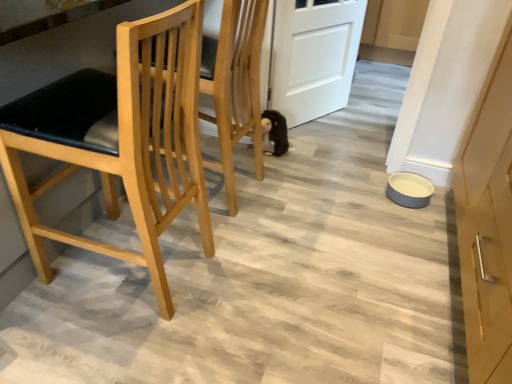
Question: Is natural wood chair at left situated inside black plush toy at center or outside?

Choices:
 (A) outside
 (B) inside

Answer: (A)

Question: In the image, is natural wood chair at left positioned in front of or behind black plush toy at center?

Choices:
 (A) front
 (B) behind

Answer: (A)

Question: Based on their relative distances, which object is farther from the black plush toy at center?

Choices:
 (A) natural wood chair at left
 (B) white matte door at center

Answer: (A)

Question: Which of these objects is positioned farthest from the natural wood chair at left?

Choices:
 (A) black plush toy at center
 (B) white matte door at center

Answer: (B)